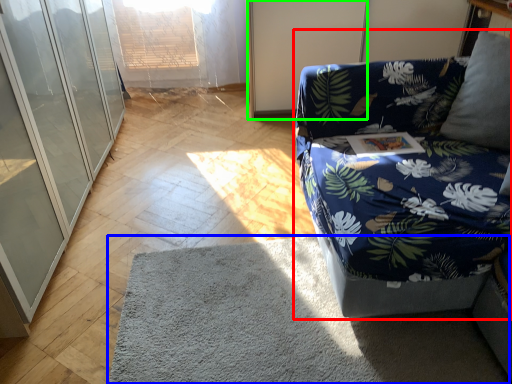
Question: Which is nearer to the studio couch (highlighted by a red box)? mat (highlighted by a blue box) or screen door (highlighted by a green box).

Choices:
 (A) mat
 (B) screen door

Answer: (A)